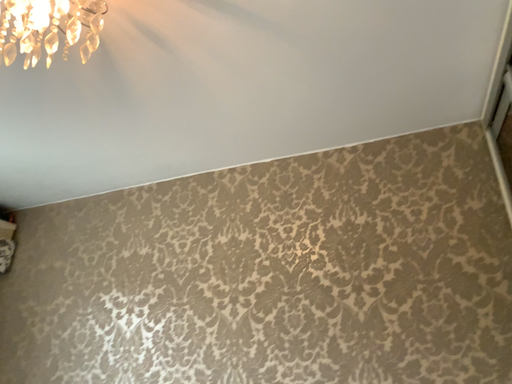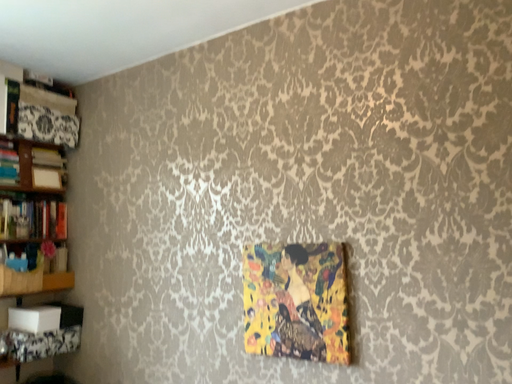
Question: How did the camera likely rotate when shooting the video?

Choices:
 (A) rotated left
 (B) rotated right

Answer: (A)